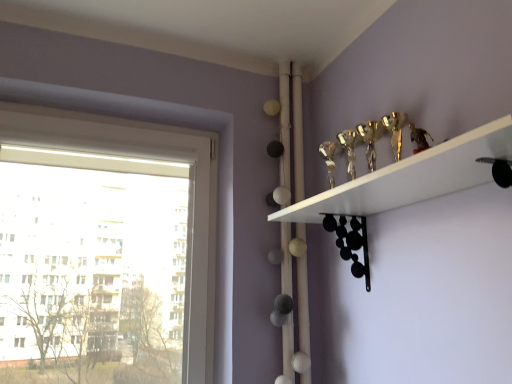
Identify the location of white plastic window at left. The width and height of the screenshot is (512, 384). (144, 157).

This screenshot has width=512, height=384. Describe the element at coordinates (144, 157) in the screenshot. I see `white plastic window at left` at that location.

Measure the distance between point (336,210) and camera.

The depth of point (336,210) is 1.32 meters.

Find the location of `gold metallic trophy at upper right`. gold metallic trophy at upper right is located at coordinates (411, 177).

This screenshot has height=384, width=512. What do you see at coordinates (411, 177) in the screenshot?
I see `gold metallic trophy at upper right` at bounding box center [411, 177].

Where is `white plastic window at left`? The width and height of the screenshot is (512, 384). white plastic window at left is located at coordinates (144, 157).

Based on the photo, between white plastic window at left and gold metallic trophy at upper right, which one appears on the left side from the viewer's perspective?

white plastic window at left is more to the left.

Is the position of white plastic window at left more distant than that of gold metallic trophy at upper right?

Yes, it is.

Does point (202, 217) come closer to viewer compared to point (365, 200)?

No, (202, 217) is behind (365, 200).

From the image's perspective, relative to gold metallic trophy at upper right, is white plastic window at left above or below?

white plastic window at left is situated lower than gold metallic trophy at upper right in the image.

From a real-world perspective, is white plastic window at left positioned over gold metallic trophy at upper right based on gravity?

Yes, from a real-world perspective, white plastic window at left is on top of gold metallic trophy at upper right.

Is white plastic window at left wider than gold metallic trophy at upper right?

No.

Considering the sizes of white plastic window at left and gold metallic trophy at upper right in the image, is white plastic window at left taller or shorter than gold metallic trophy at upper right?

white plastic window at left is taller than gold metallic trophy at upper right.

Is white plastic window at left smaller than gold metallic trophy at upper right?

No, white plastic window at left is not smaller than gold metallic trophy at upper right.

Is gold metallic trophy at upper right located within white plastic window at left?

No, white plastic window at left does not contain gold metallic trophy at upper right.

Would you consider white plastic window at left to be distant from gold metallic trophy at upper right?

No, there isn't a large distance between white plastic window at left and gold metallic trophy at upper right.

Is white plastic window at left oriented towards gold metallic trophy at upper right?

No, white plastic window at left is not turned towards gold metallic trophy at upper right.

Locate an element on the screen. Image resolution: width=512 pixels, height=384 pixels. shelf above the white plastic window at left (from the image's perspective) is located at coordinates (411, 177).

Considering the relative positions of gold metallic trophy at upper right and white plastic window at left in the image provided, is gold metallic trophy at upper right to the right of white plastic window at left from the viewer's perspective?

Indeed, gold metallic trophy at upper right is positioned on the right side of white plastic window at left.

Considering the relative positions of gold metallic trophy at upper right and white plastic window at left in the image provided, is gold metallic trophy at upper right in front of white plastic window at left?

Yes, it is.

Is point (486, 143) in front of point (3, 139)?

That is True.

Based on the photo, from the image's perspective, is gold metallic trophy at upper right above white plastic window at left?

Indeed, from the image's perspective, gold metallic trophy at upper right is shown above white plastic window at left.

From a real-world perspective, which object rests below the other?

In real-world perspective, gold metallic trophy at upper right is lower.

Between gold metallic trophy at upper right and white plastic window at left, which one has larger width?

gold metallic trophy at upper right.

Between gold metallic trophy at upper right and white plastic window at left, which one has more height?

With more height is white plastic window at left.

Which of these two, gold metallic trophy at upper right or white plastic window at left, is bigger?

With larger size is white plastic window at left.

Can white plastic window at left be found inside gold metallic trophy at upper right?

That's incorrect, white plastic window at left is not inside gold metallic trophy at upper right.

From the picture: Is gold metallic trophy at upper right touching white plastic window at left?

No, gold metallic trophy at upper right is not touching white plastic window at left.

Could you tell me if gold metallic trophy at upper right is turned towards white plastic window at left?

Yes, gold metallic trophy at upper right is aimed at white plastic window at left.

Can you tell me how much gold metallic trophy at upper right and white plastic window at left differ in facing direction?

89.8 degrees separate the facing orientations of gold metallic trophy at upper right and white plastic window at left.

How far apart are gold metallic trophy at upper right and white plastic window at left?

gold metallic trophy at upper right and white plastic window at left are 29.90 inches apart from each other.

Locate an element on the screen. The width and height of the screenshot is (512, 384). window behind the gold metallic trophy at upper right is located at coordinates (144, 157).

You are a GUI agent. You are given a task and a screenshot of the screen. Output one action in this format:
    pyautogui.click(x=<x>, y=<y>)
    Task: Click on the shelf in front of the white plastic window at left
    The image size is (512, 384).
    Given the screenshot: What is the action you would take?
    pyautogui.click(x=411, y=177)

In the image, there is a white plastic window at left. Where is `shelf below it (from a real-world perspective)`? shelf below it (from a real-world perspective) is located at coordinates (411, 177).